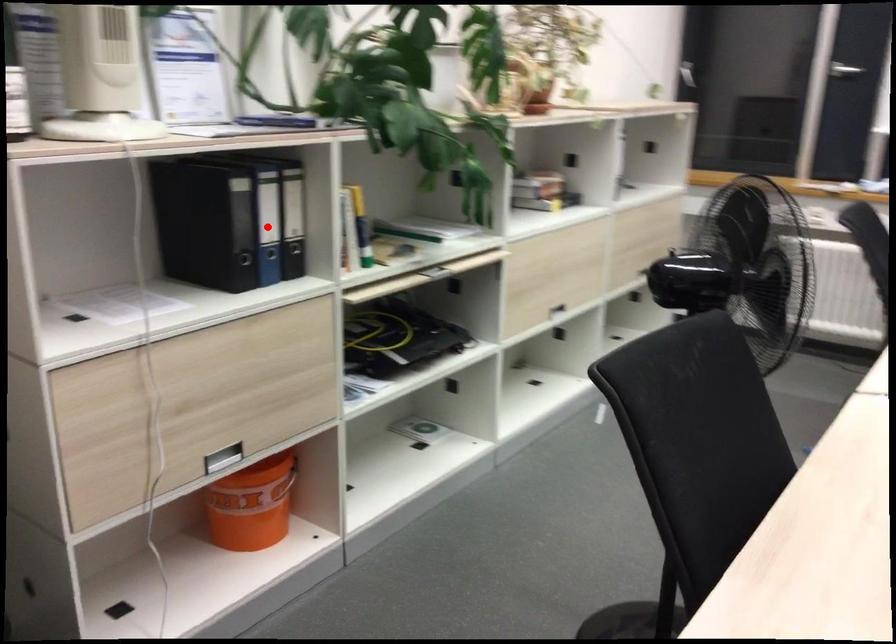
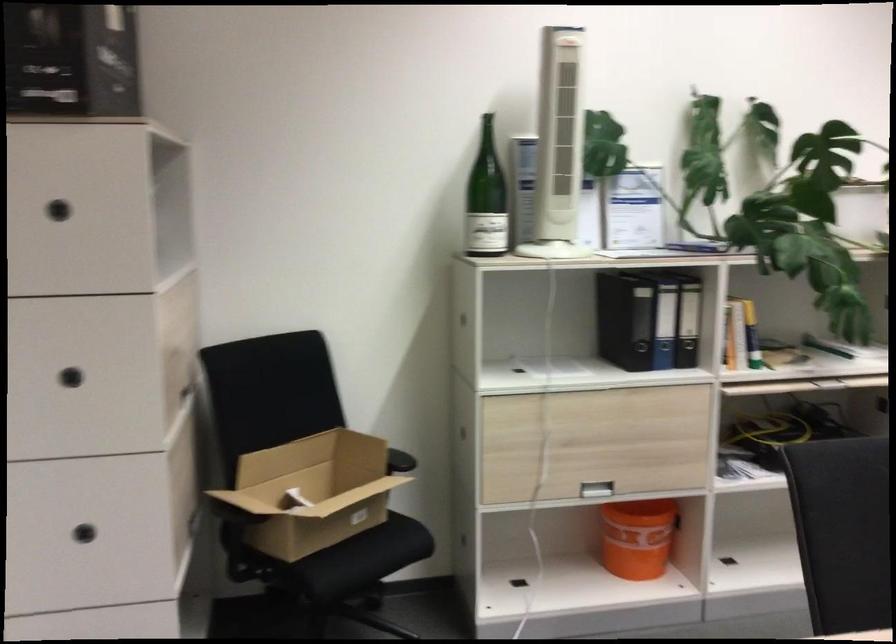
Question: A red point is marked in image1. In image2, is the corresponding 3D point closer to the camera or farther? Reply with the corresponding letter.

Choices:
 (A) The corresponding 3D point is closer.
 (B) The corresponding 3D point is farther.

Answer: (B)